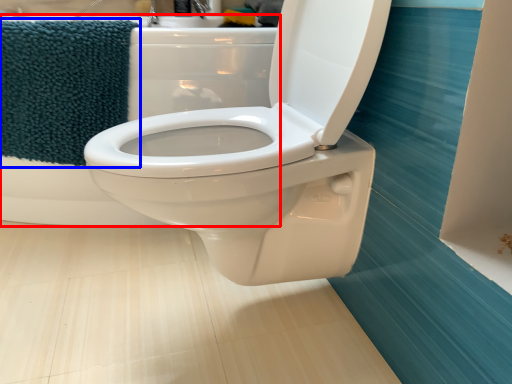
Question: Which object is closer to the camera taking this photo, bath (highlighted by a red box) or beach towel (highlighted by a blue box)?

Choices:
 (A) bath
 (B) beach towel

Answer: (A)